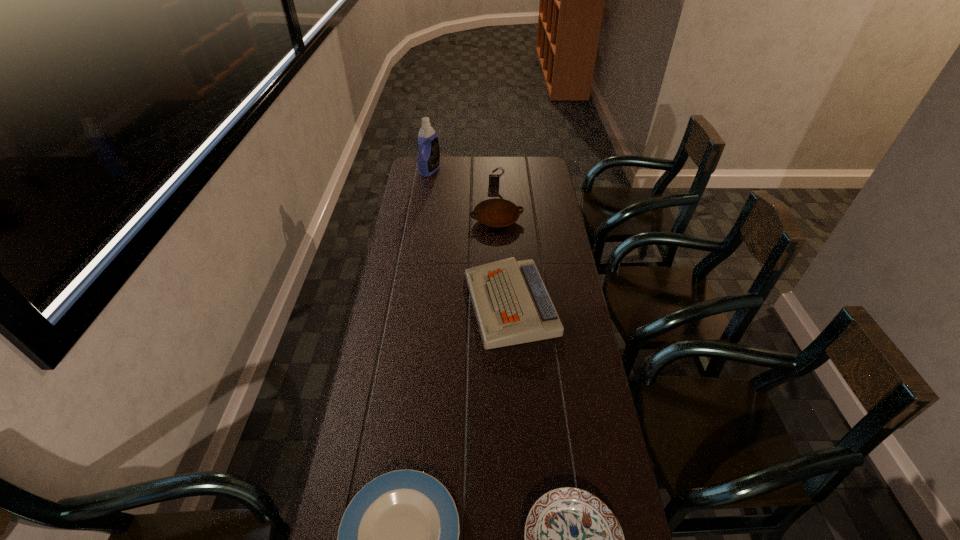
I want to click on free spot between the third farthest object and the tallest object, so click(x=464, y=195).

Identify the location of free space between the fourth shortest object and the second tallest object. This screenshot has height=540, width=960. (503, 245).

Locate an element on the screen. The height and width of the screenshot is (540, 960). blank region between the tallest plate and the farthest object is located at coordinates click(464, 195).

Locate an element on the screen. This screenshot has width=960, height=540. free space between the tallest object and the fifth shortest object is located at coordinates (463, 178).

You are a GUI agent. You are given a task and a screenshot of the screen. Output one action in this format:
    pyautogui.click(x=<x>, y=<y>)
    Task: Click on the fourth closest object to the detergent
    The width and height of the screenshot is (960, 540).
    Given the screenshot: What is the action you would take?
    (x=398, y=538)

Find the location of a particular element. This screenshot has height=540, width=960. object that is the third closest to the leftmost plate is located at coordinates (496, 212).

You are a GUI agent. You are given a task and a screenshot of the screen. Output one action in this format:
    pyautogui.click(x=<x>, y=<y>)
    Task: Click on the plate that stands as the closest to the second farthest object
    
    Given the screenshot: What is the action you would take?
    pyautogui.click(x=496, y=212)

The width and height of the screenshot is (960, 540). I want to click on plate that is the closest to the fourth nearest object, so click(398, 538).

Identify the location of vacant space that satisfies the following two spatial constraints: 1. on the front side of the third farthest object; 2. on the right side of the farthest object. (422, 220).